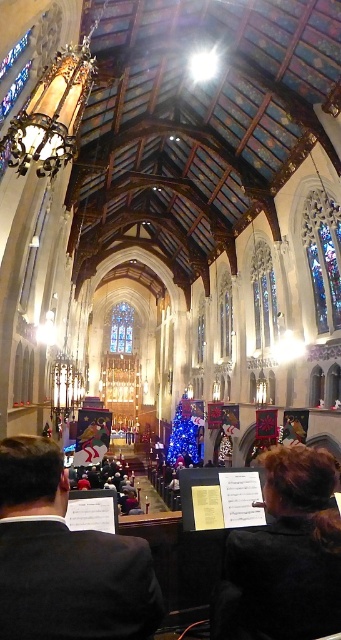
You are standing at the entrance of the cathedral and want to take a photo of the stained glass window at upper right without the stained glass window at center blocking the view. Is this possible?

The stained glass window at upper right is in front of the stained glass window at center, so you can take a photo of the stained glass window at upper right without it being blocked by the stained glass window at center.

You are standing at the entrance of the cathedral and see two points marked in the image. The first point is at coordinate point (160, 604) and the second is at point (332, 205). Which point is closer to you?

Point (160, 604) is closer to the camera than point (332, 205), so the first point is closer to you.